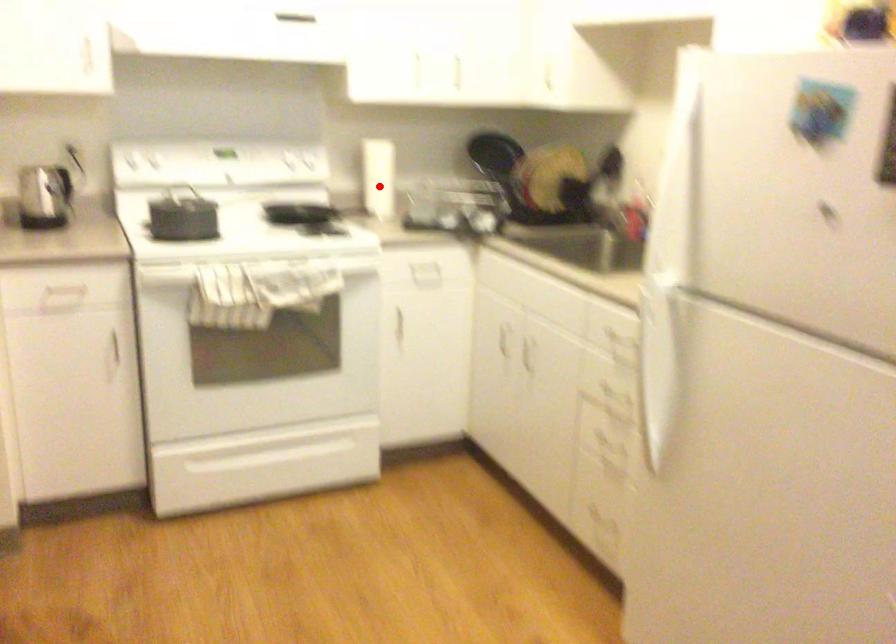
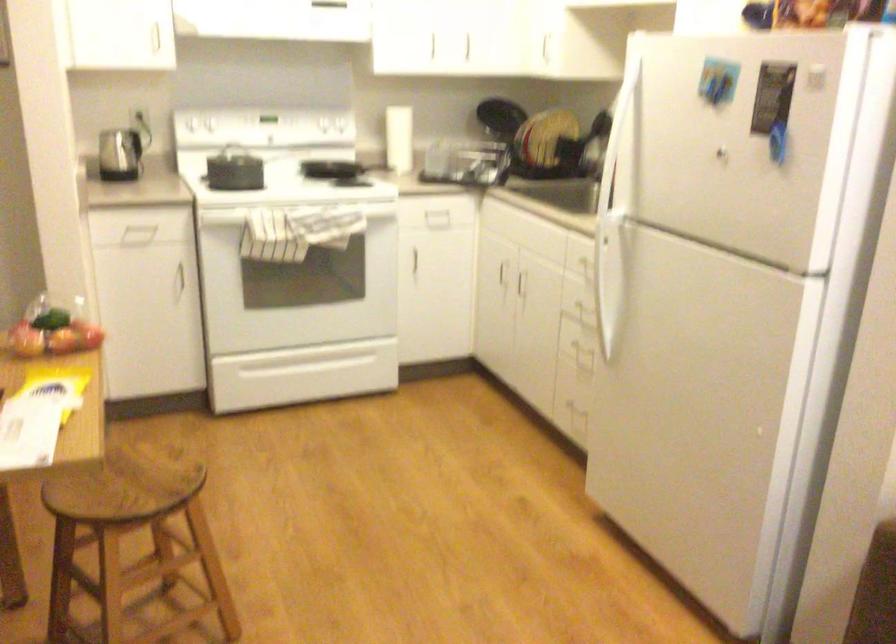
Locate, in the second image, the point that corresponds to the highlighted location in the first image.

(399, 138)